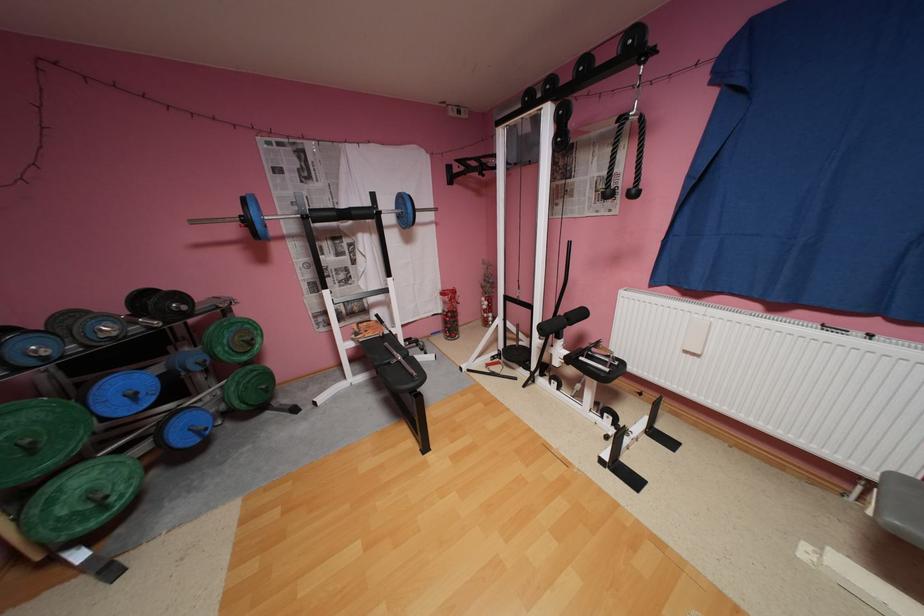
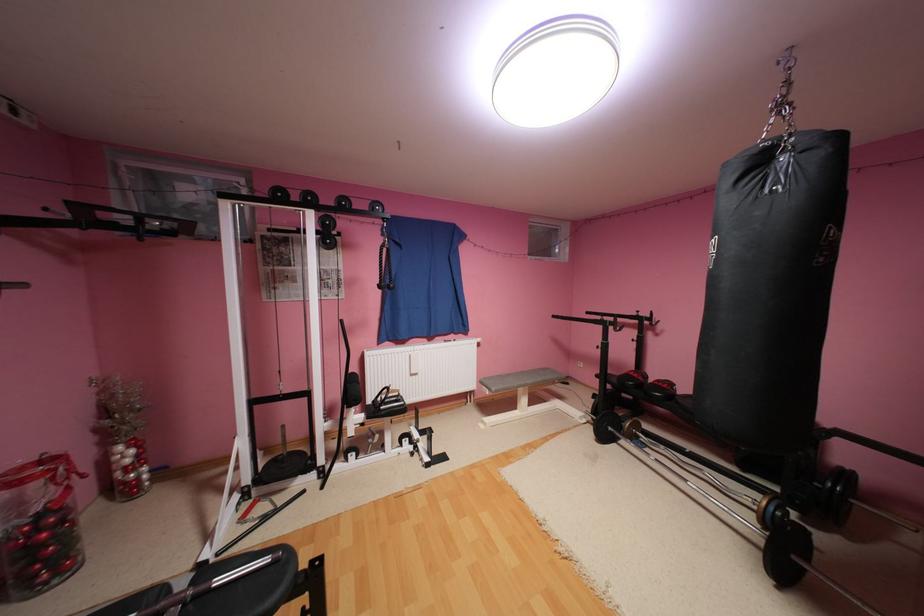
In the second image, find the point that corresponds to [470,168] in the first image.

(78, 216)